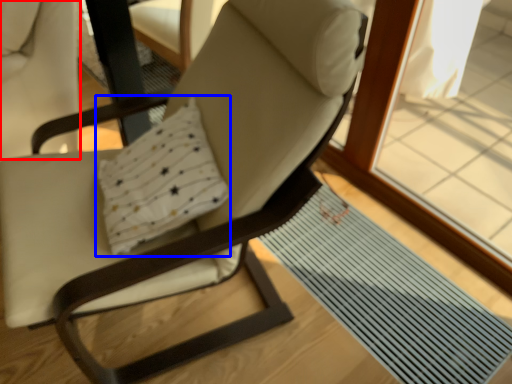
Question: Which point is closer to the camera, swivel chair (highlighted by a red box) or pillow (highlighted by a blue box)?

Choices:
 (A) swivel chair
 (B) pillow

Answer: (B)